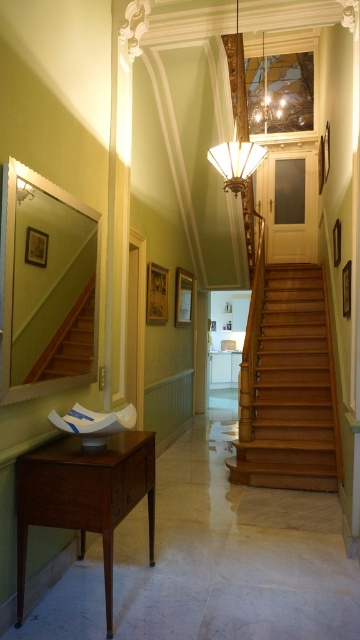
Between light brown wooden stairs at center and metallic glass chandelier at upper center, which one appears on the right side from the viewer's perspective?

From the viewer's perspective, metallic glass chandelier at upper center appears more on the right side.

In the scene shown: Who is more forward, (272, 408) or (261, 112)?

Point (272, 408) is more forward.

You are a GUI agent. You are given a task and a screenshot of the screen. Output one action in this format:
    pyautogui.click(x=<x>, y=<y>)
    Task: Click on the light brown wooden stairs at center
    The height and width of the screenshot is (640, 360).
    Given the screenshot: What is the action you would take?
    pyautogui.click(x=289, y=387)

From the picture: Can you confirm if light brown wooden stairs at center is positioned above matte glass lampshade at center?

No.

This screenshot has height=640, width=360. I want to click on light brown wooden stairs at center, so click(289, 387).

The width and height of the screenshot is (360, 640). What do you see at coordinates (69, 342) in the screenshot?
I see `wooden stairs at left` at bounding box center [69, 342].

Consider the image. Can you confirm if wooden stairs at left is positioned to the left of matte glass lampshade at center?

Yes, wooden stairs at left is to the left of matte glass lampshade at center.

Is point (92, 360) behind point (249, 168)?

No, it is in front of (249, 168).

Where is `wooden stairs at left`? This screenshot has height=640, width=360. wooden stairs at left is located at coordinates (69, 342).